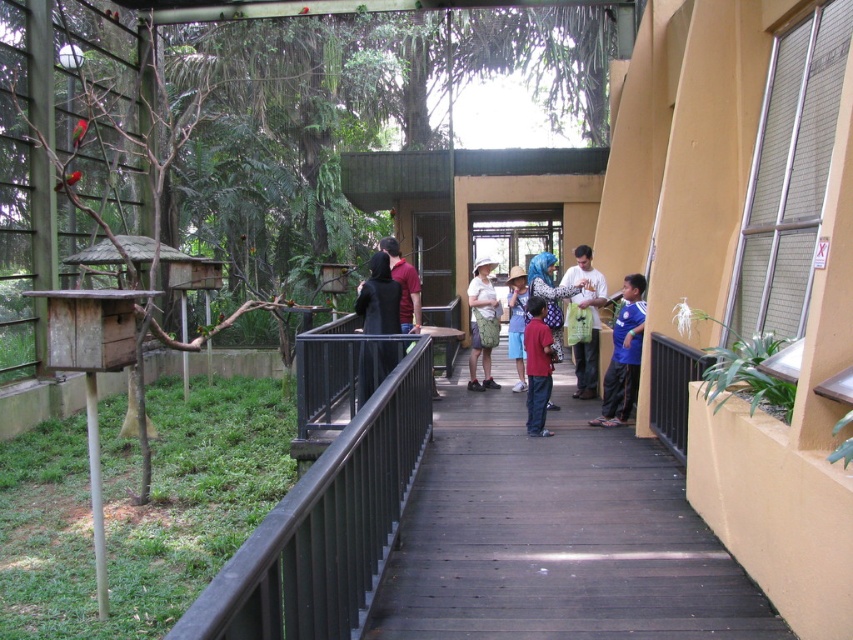
Question: Which point is closer to the camera?

Choices:
 (A) (x=548, y=442)
 (B) (x=541, y=316)
 (C) (x=373, y=253)
 (D) (x=537, y=280)

Answer: (A)

Question: Does blue printed shirt at center appear on the left side of blue jersey at center?

Choices:
 (A) yes
 (B) no

Answer: (A)

Question: Considering the real-world distances, which object is closest to the wooden walkway at center?

Choices:
 (A) blue printed shirt at center
 (B) black metal/rail at lower center

Answer: (B)

Question: Considering the relative positions of wooden walkway at center and black matte jacket at center in the image provided, where is wooden walkway at center located with respect to black matte jacket at center?

Choices:
 (A) above
 (B) below

Answer: (B)

Question: Can you confirm if black metal/rail at lower center is smaller than white cotton shirt at center?

Choices:
 (A) yes
 (B) no

Answer: (B)

Question: Estimate the real-world distances between objects in this image. Which object is farther from the blue jersey at center?

Choices:
 (A) wooden walkway at center
 (B) black metal/rail at lower center
 (C) camouflage shorts at center
 (D) blue printed shirt at center

Answer: (A)